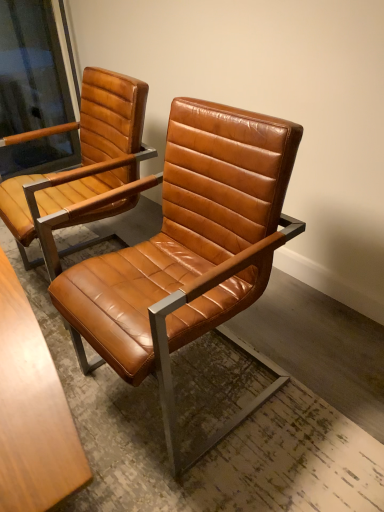
Question: Does matte brown leather chair arm at upper left have a greater width compared to cognac leather chair at center, positioned as the second chair in right-to-left order?

Choices:
 (A) no
 (B) yes

Answer: (A)

Question: Is matte brown leather chair arm at upper left positioned beyond the bounds of cognac leather chair at center, positioned as the second chair in right-to-left order?

Choices:
 (A) no
 (B) yes

Answer: (B)

Question: From the image's perspective, does matte brown leather chair arm at upper left appear lower than cognac leather chair at center, which is counted as the 1th chair, starting from the left?

Choices:
 (A) yes
 (B) no

Answer: (B)

Question: Is matte brown leather chair arm at upper left to the left of cognac leather chair at center, which is counted as the 1th chair, starting from the left, from the viewer's perspective?

Choices:
 (A) no
 (B) yes

Answer: (B)

Question: From a real-world perspective, does matte brown leather chair arm at upper left stand above cognac leather chair at center, which is counted as the 1th chair, starting from the left?

Choices:
 (A) yes
 (B) no

Answer: (A)

Question: In terms of size, does matte brown leather chair arm at upper left appear bigger or smaller than cognac leather chair at center, positioned as the second chair in right-to-left order?

Choices:
 (A) big
 (B) small

Answer: (B)

Question: Is matte brown leather chair arm at upper left to the left or to the right of cognac leather chair at center, positioned as the second chair in right-to-left order, in the image?

Choices:
 (A) left
 (B) right

Answer: (A)

Question: Is matte brown leather chair arm at upper left spatially inside cognac leather chair at center, which is counted as the 1th chair, starting from the left, or outside of it?

Choices:
 (A) inside
 (B) outside

Answer: (B)

Question: Considering the positions of matte brown leather chair arm at upper left and cognac leather chair at center, positioned as the second chair in right-to-left order, in the image, is matte brown leather chair arm at upper left wider or thinner than cognac leather chair at center, positioned as the second chair in right-to-left order,?

Choices:
 (A) thin
 (B) wide

Answer: (A)

Question: From their relative heights in the image, would you say cognac leather chair at center, positioned as the second chair in right-to-left order, is taller or shorter than matte brown leather chair arm at upper left?

Choices:
 (A) short
 (B) tall

Answer: (B)

Question: In terms of width, does cognac leather chair at center, positioned as the second chair in right-to-left order, look wider or thinner when compared to matte brown leather chair arm at upper left?

Choices:
 (A) thin
 (B) wide

Answer: (B)

Question: Is point pyautogui.click(x=105, y=182) positioned closer to the camera than point pyautogui.click(x=67, y=159)?

Choices:
 (A) closer
 (B) farther

Answer: (A)

Question: Considering the positions of cognac leather chair at center, which is counted as the 1th chair, starting from the left, and matte brown leather chair arm at upper left in the image, is cognac leather chair at center, which is counted as the 1th chair, starting from the left, bigger or smaller than matte brown leather chair arm at upper left?

Choices:
 (A) big
 (B) small

Answer: (A)

Question: Is cognac leather chair at center, positioned as the second chair in right-to-left order, wider or thinner than cognac leather chair at center, which is counted as the 2th chair, starting from the left?

Choices:
 (A) wide
 (B) thin

Answer: (B)

Question: Considering the positions of cognac leather chair at center, positioned as the second chair in right-to-left order, and cognac leather chair at center, which is counted as the 2th chair, starting from the left, in the image, is cognac leather chair at center, positioned as the second chair in right-to-left order, bigger or smaller than cognac leather chair at center, which is counted as the 2th chair, starting from the left,?

Choices:
 (A) small
 (B) big

Answer: (A)